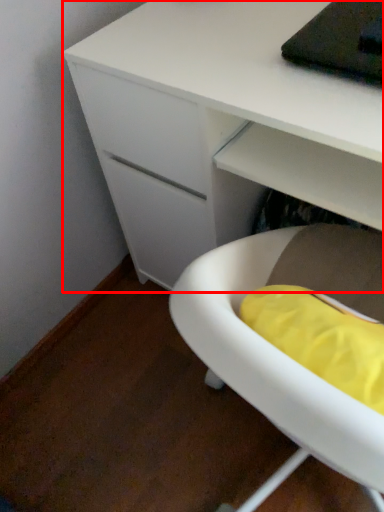
Question: From the image's perspective, what is the correct spatial positioning of desk (annotated by the red box) in reference to furniture?

Choices:
 (A) above
 (B) below

Answer: (A)